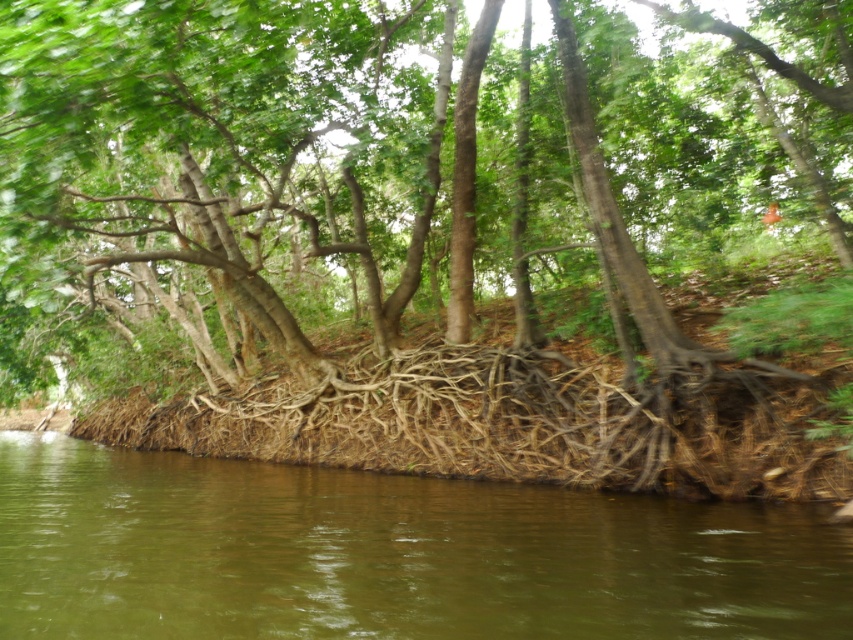
You are standing at the riverside and want to reach both the point at coordinates point (395, 339) and point (149, 518). Which point will you reach first while moving towards them?

You will reach the point (395, 339) first because it is closer to you than the point (149, 518), which is further away.

Looking at this image, you are standing on the bank of the river and want to cross to the other side. You see the brown rough roots at center and the brown muddy water at lower center. Which object is closer to your left side when facing the river?

The brown rough roots at center is positioned on the left side of brown muddy water at lower center, so when facing the river, the brown rough roots at center would be closer to your left side.